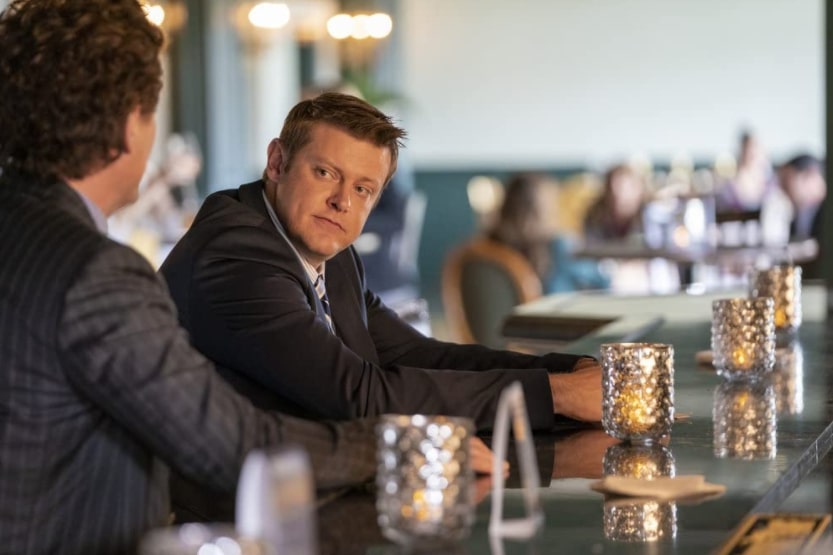
Locate an element on the screen. blurred candle is located at coordinates (427, 489).